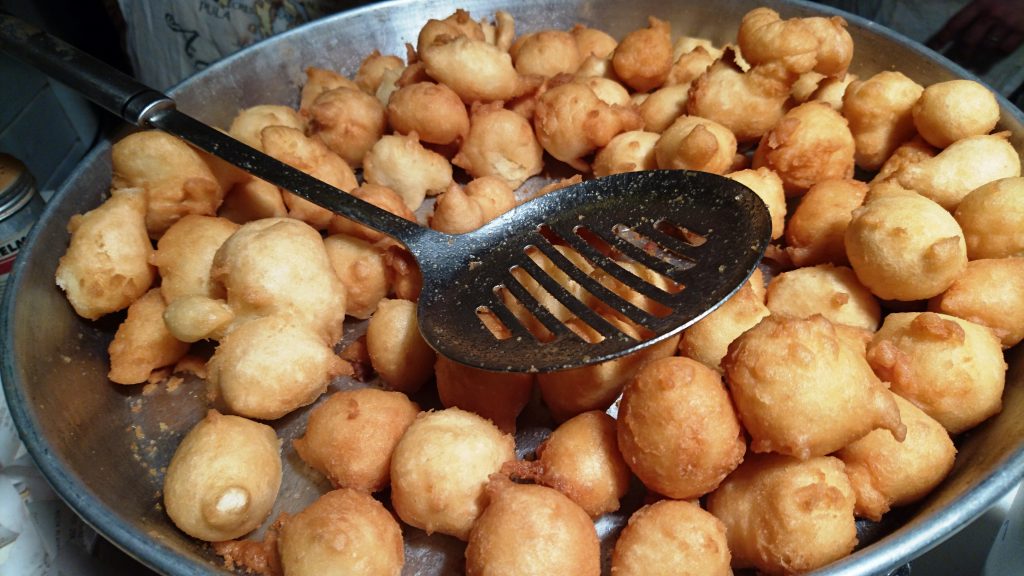
This screenshot has height=576, width=1024. What are the coordinates of `silver spatula` in the screenshot? It's located at (469, 264).